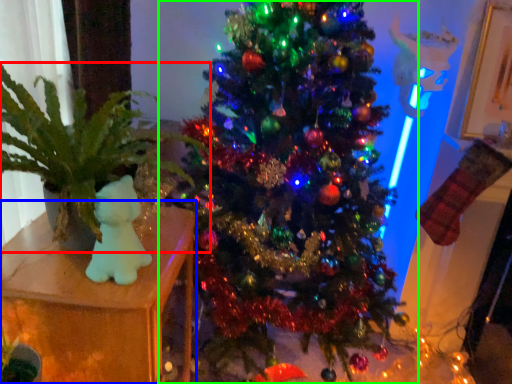
Question: Which object is the closest to the houseplant (highlighted by a red box)? Choose among these: furniture (highlighted by a blue box) or christmas tree (highlighted by a green box).

Choices:
 (A) furniture
 (B) christmas tree

Answer: (A)